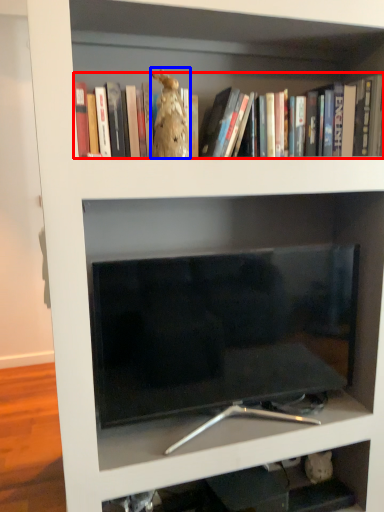
Question: Among these objects, which one is nearest to the camera, book (highlighted by a red box) or animal (highlighted by a blue box)?

Choices:
 (A) book
 (B) animal

Answer: (A)